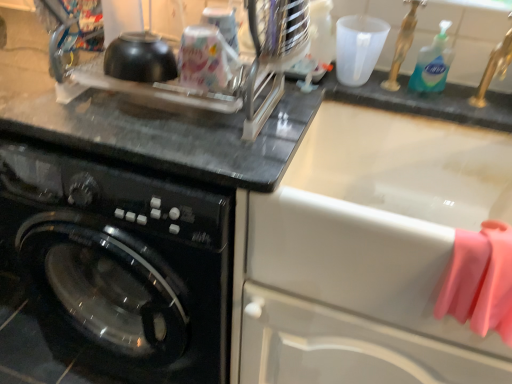
Locate an element on the screen. The height and width of the screenshot is (384, 512). vacant space situated on the left part of blue liquid soap at upper right is located at coordinates (370, 88).